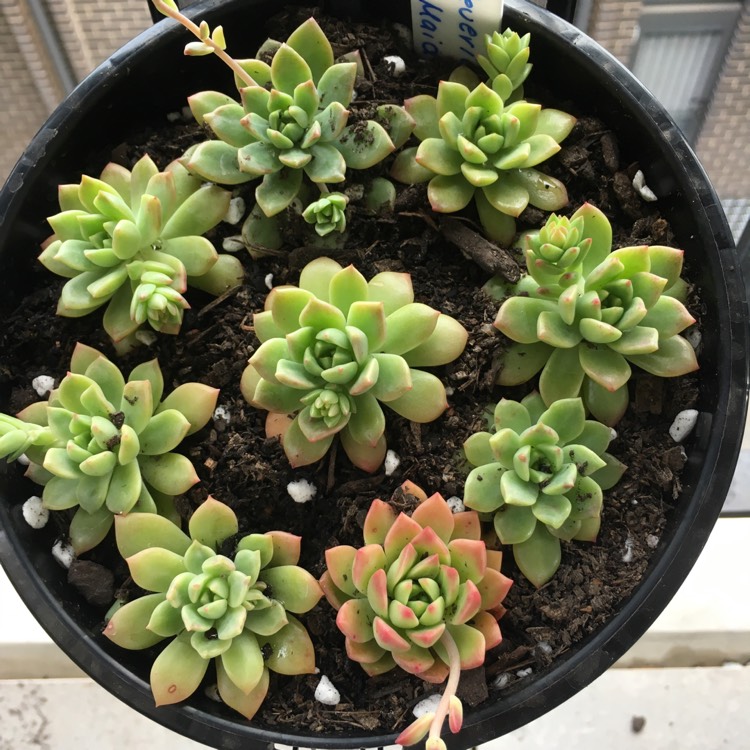
What are the coordinates of `pot` in the screenshot? It's located at (640, 601).